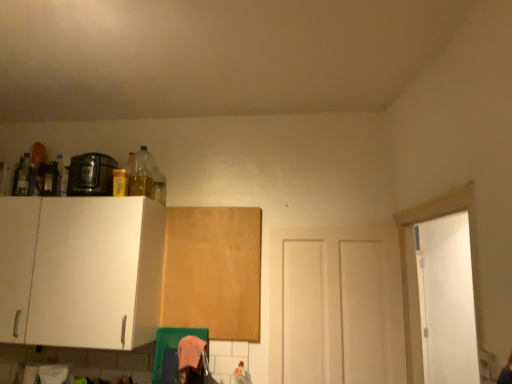
Question: Does shiny black toaster at upper left have a smaller size compared to wooden board at center, positioned as the 1th cabinetry in right-to-left order?

Choices:
 (A) no
 (B) yes

Answer: (A)

Question: Is the depth of shiny black toaster at upper left greater than that of wooden board at center, which ranks as the 2th cabinetry in left-to-right order?

Choices:
 (A) yes
 (B) no

Answer: (B)

Question: Can wooden board at center, which ranks as the 2th cabinetry in left-to-right order, be found inside shiny black toaster at upper left?

Choices:
 (A) yes
 (B) no

Answer: (B)

Question: From the image's perspective, is shiny black toaster at upper left beneath wooden board at center, which ranks as the 2th cabinetry in left-to-right order?

Choices:
 (A) no
 (B) yes

Answer: (A)

Question: Is shiny black toaster at upper left not within wooden board at center, which ranks as the 2th cabinetry in left-to-right order?

Choices:
 (A) no
 (B) yes

Answer: (B)

Question: From a real-world perspective, relative to white matte cabinet at left, the first cabinetry positioned from the left, is wooden board at center, which ranks as the 2th cabinetry in left-to-right order, vertically above or below?

Choices:
 (A) below
 (B) above

Answer: (B)

Question: Choose the correct answer: Is wooden board at center, positioned as the 1th cabinetry in right-to-left order, inside white matte cabinet at left, the second cabinetry in the right-to-left sequence, or outside it?

Choices:
 (A) outside
 (B) inside

Answer: (A)

Question: From the image's perspective, relative to white matte cabinet at left, the first cabinetry positioned from the left, is wooden board at center, positioned as the 1th cabinetry in right-to-left order, above or below?

Choices:
 (A) below
 (B) above

Answer: (A)

Question: Is wooden board at center, positioned as the 1th cabinetry in right-to-left order, in front of or behind white matte cabinet at left, the second cabinetry in the right-to-left sequence, in the image?

Choices:
 (A) front
 (B) behind

Answer: (B)

Question: Considering the positions of white matte cabinet at left, the first cabinetry positioned from the left, and wooden board at center, positioned as the 1th cabinetry in right-to-left order, in the image, is white matte cabinet at left, the first cabinetry positioned from the left, taller or shorter than wooden board at center, positioned as the 1th cabinetry in right-to-left order,?

Choices:
 (A) short
 (B) tall

Answer: (A)

Question: Looking at the image, does white matte cabinet at left, the first cabinetry positioned from the left, seem bigger or smaller compared to wooden board at center, which ranks as the 2th cabinetry in left-to-right order?

Choices:
 (A) small
 (B) big

Answer: (B)

Question: In terms of width, does white matte cabinet at left, the second cabinetry in the right-to-left sequence, look wider or thinner when compared to wooden board at center, which ranks as the 2th cabinetry in left-to-right order?

Choices:
 (A) thin
 (B) wide

Answer: (B)

Question: From the image's perspective, is white matte cabinet at left, the second cabinetry in the right-to-left sequence, above or below wooden board at center, which ranks as the 2th cabinetry in left-to-right order?

Choices:
 (A) above
 (B) below

Answer: (A)

Question: Looking at their shapes, would you say white matte door at center is wider or thinner than wooden board at center, positioned as the 1th cabinetry in right-to-left order?

Choices:
 (A) wide
 (B) thin

Answer: (A)

Question: From the image's perspective, is white matte door at center positioned above or below wooden board at center, which ranks as the 2th cabinetry in left-to-right order?

Choices:
 (A) below
 (B) above

Answer: (A)